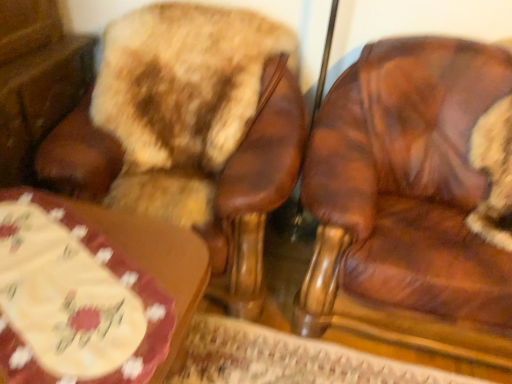
Find the location of a particular element. The image size is (512, 384). free point above wooden table at lower left (from a real-world perspective) is located at coordinates (72, 274).